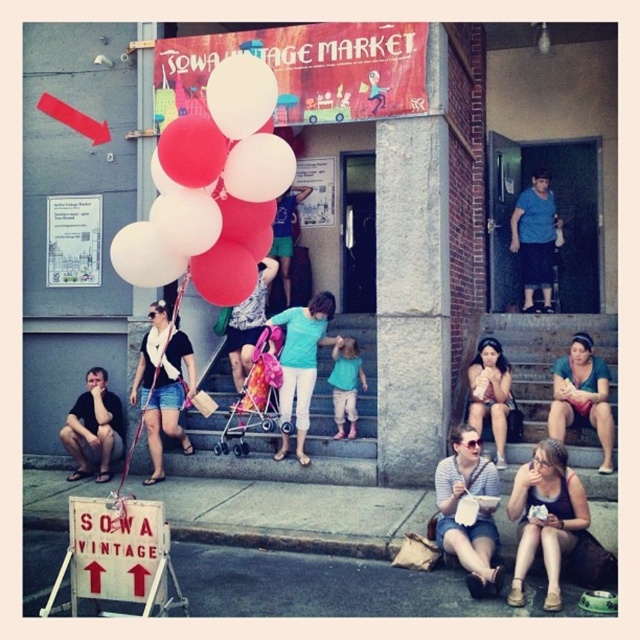
Question: Estimate the real-world distances between objects in this image. Which object is closer to the teal fabric shirt at lower right?

Choices:
 (A) matte black tank top at lower right
 (B) matte teal shirt at center
 (C) smooth concrete stairs at lower center

Answer: (C)

Question: Can you confirm if teal fabric shirt at lower right is smaller than matte black shorts at lower left?

Choices:
 (A) yes
 (B) no

Answer: (B)

Question: Does matte pink stroller at center appear under matte teal shirt at center?

Choices:
 (A) no
 (B) yes

Answer: (B)

Question: Can you confirm if matte pink stroller at center is thinner than white matte balloon at upper center?

Choices:
 (A) no
 (B) yes

Answer: (A)

Question: Based on their relative distances, which object is farther from the matte black tank top at lower right?

Choices:
 (A) teal fabric shirt at lower right
 (B) matte teal shirt at center
 (C) matte white balloons at center

Answer: (B)

Question: Which is farther from the matte black baguette at center?

Choices:
 (A) blue cotton shirt at upper center
 (B) white matte balloon at upper center

Answer: (B)